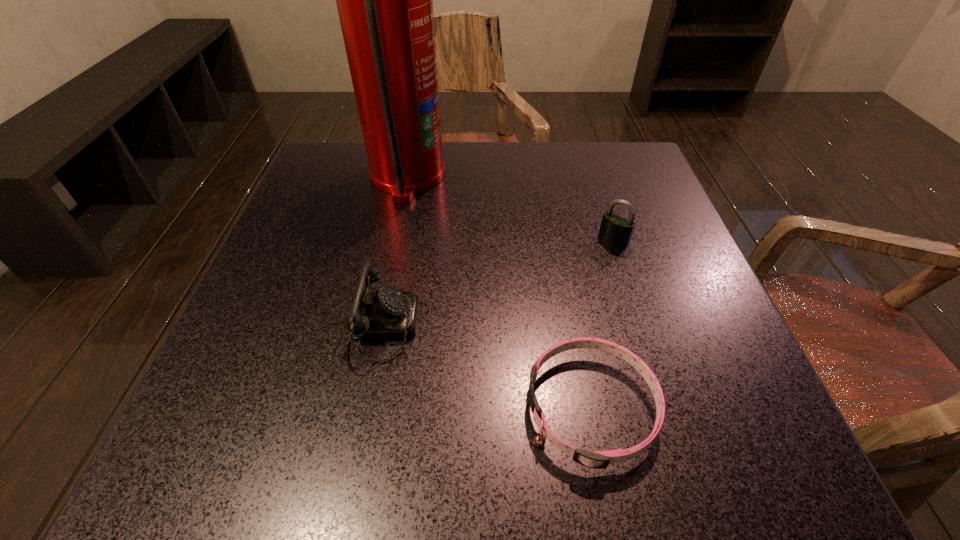
This screenshot has width=960, height=540. In order to click on unoccupied area between the telephone and the tallest object in this screenshot , I will do `click(382, 247)`.

The height and width of the screenshot is (540, 960). Find the location of `vacant area between the farthest object and the padlock`. vacant area between the farthest object and the padlock is located at coordinates (511, 208).

Locate an element on the screen. The image size is (960, 540). free area in between the padlock and the telephone is located at coordinates (485, 278).

Find the location of a particular element. The image size is (960, 540). empty location between the padlock and the tallest object is located at coordinates (511, 208).

Identify which object is the third nearest to the dog collar. Please provide its 2D coordinates. Your answer should be formatted as a tuple, i.e. [(x, y)], where the tuple contains the x and y coordinates of a point satisfying the conditions above.

[(384, 0)]

Identify the location of object that ranks as the third closest to the tallest object. This screenshot has width=960, height=540. (600, 459).

The image size is (960, 540). In order to click on vacant space that satisfies the following two spatial constraints: 1. on the instruction side of the padlock; 2. on the left side of the farthest object in this screenshot , I will do `click(395, 240)`.

Identify the location of vacant area that satisfies the following two spatial constraints: 1. on the instruction side of the tallest object; 2. on the left side of the padlock. The height and width of the screenshot is (540, 960). (395, 240).

The image size is (960, 540). I want to click on blank area in the image that satisfies the following two spatial constraints: 1. on the front side of the padlock; 2. with the buckle on the shortest object, so click(x=667, y=408).